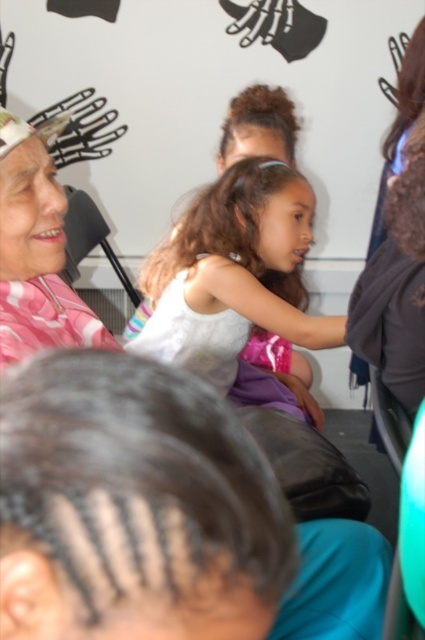
You are standing in the room and want to hand a gift to the person wearing the white satin dress at center and the pink plaid shirt at upper left. Which one can you reach without moving closer?

The white satin dress at center is closer to you than the pink plaid shirt at upper left, so you can reach the person wearing the white satin dress at center without moving closer.

You are a photographer setting up for an event. You have two items to place in the scene described. The white satin dress at center and the pink plaid shirt at upper left. Given their sizes, which item should you position closer to the camera to ensure both are visible without overlapping?

The white satin dress at center is taller than the pink plaid shirt at upper left, so positioning the pink plaid shirt at upper left closer to the camera would prevent overlap while maintaining visibility of both items.